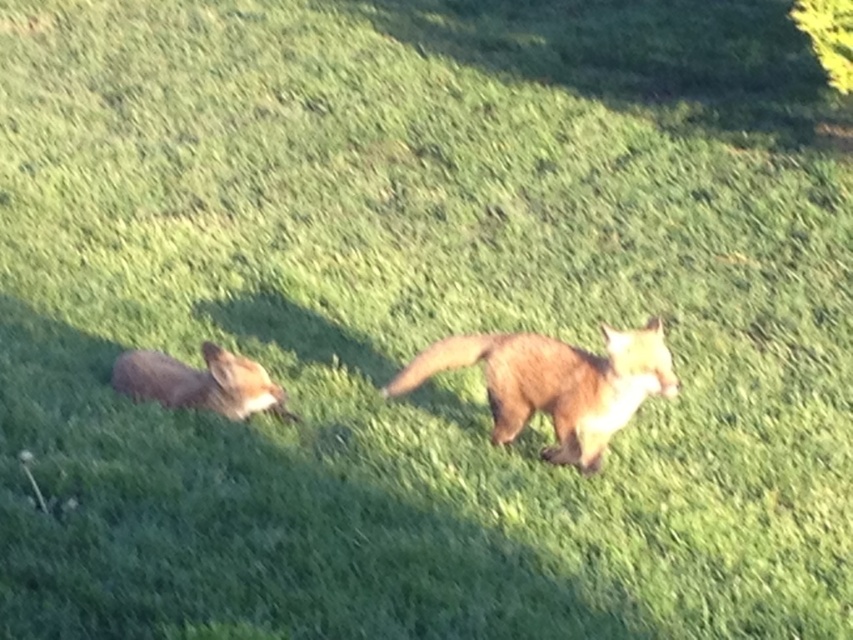
You are a photographer trying to capture a closeup shot of the fox on the left. You notice two points in the scene marked as point 1 at coordinates point (637,394) and point 2 at coordinates point (166,378). Which point should you focus on to ensure the fox on the left is in sharp focus?

You should focus on point 1 at coordinates point (637,394) because it is closer to the camera than point 2 at coordinates point (166,378), ensuring the fox on the left will be in sharp focus.